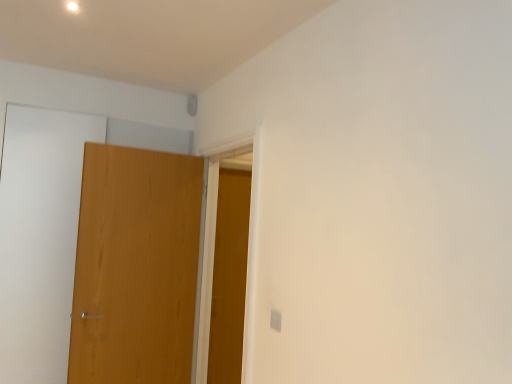
Question: Is wooden door at left, positioned as the first door in left-to-right order, in front of or behind wooden door at center, the second door from the left, in the image?

Choices:
 (A) behind
 (B) front

Answer: (B)

Question: Would you say wooden door at left, marked as the 2th door in a back-to-front arrangement, is to the left or to the right of wooden door at center, arranged as the 1th door when viewed from the back, in the picture?

Choices:
 (A) left
 (B) right

Answer: (A)

Question: Is wooden door at left, arranged as the second door when viewed from the right, inside the boundaries of wooden door at center, marked as the second door in a front-to-back arrangement, or outside?

Choices:
 (A) outside
 (B) inside

Answer: (A)

Question: Considering the positions of wooden door at center, the first door when ordered from right to left, and wooden door at left, positioned as the 1th door in front-to-back order, in the image, is wooden door at center, the first door when ordered from right to left, taller or shorter than wooden door at left, positioned as the 1th door in front-to-back order,?

Choices:
 (A) tall
 (B) short

Answer: (A)

Question: From the image's perspective, is wooden door at center, arranged as the 1th door when viewed from the back, above or below wooden door at left, positioned as the first door in left-to-right order?

Choices:
 (A) above
 (B) below

Answer: (B)

Question: Does point (228, 332) appear closer or farther from the camera than point (146, 374)?

Choices:
 (A) closer
 (B) farther

Answer: (B)

Question: In terms of width, does wooden door at center, the second door from the left, look wider or thinner when compared to wooden door at left, positioned as the first door in left-to-right order?

Choices:
 (A) wide
 (B) thin

Answer: (B)